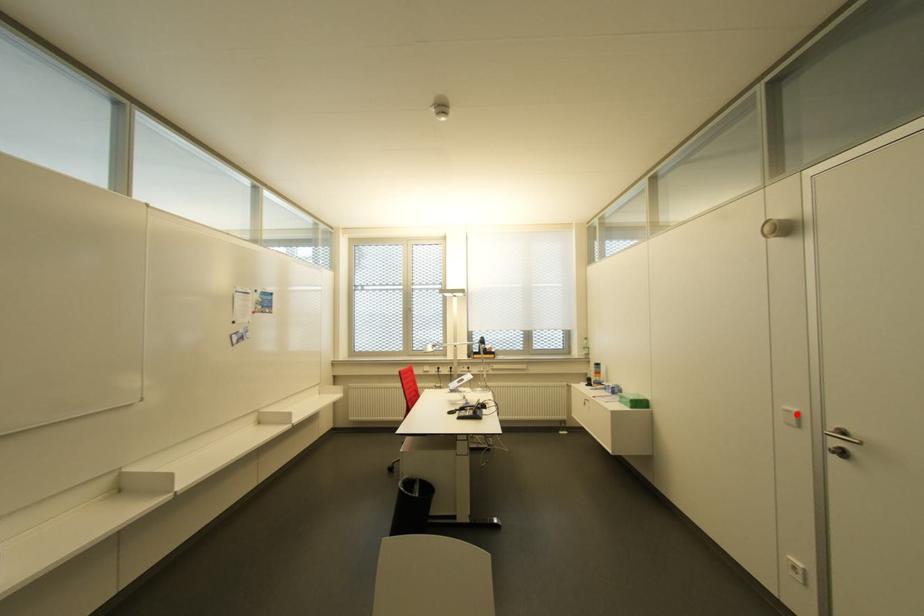
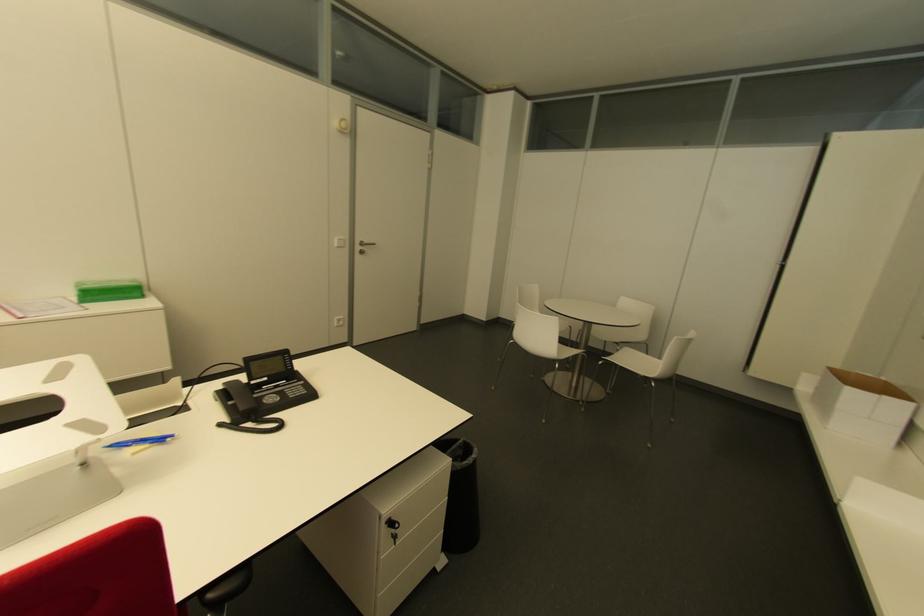
In the second image, find the point that corresponds to the highlighted location in the first image.

(343, 240)